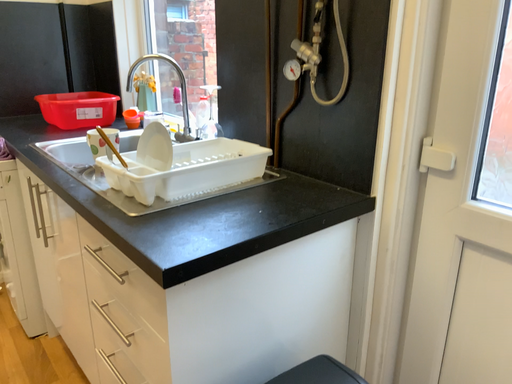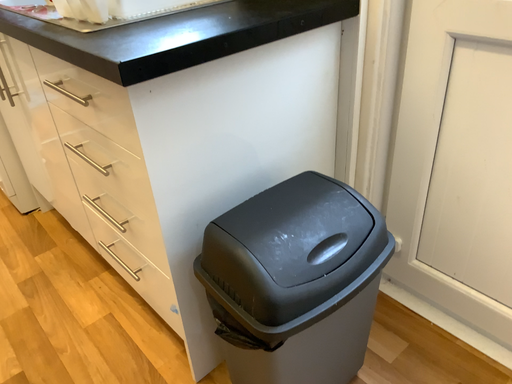
Question: Which way did the camera rotate in the video?

Choices:
 (A) rotated downward
 (B) rotated upward

Answer: (A)